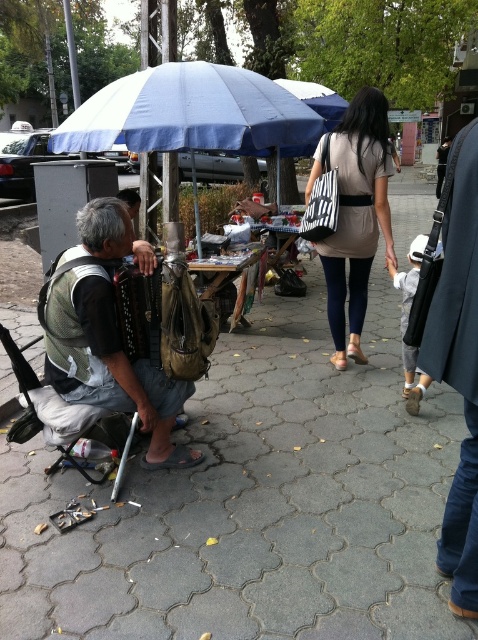
Between dark gray coat at right and beige fabric bag at center, which one is positioned higher?

beige fabric bag at center is higher up.

Between dark gray coat at right and beige fabric bag at center, which one appears on the left side from the viewer's perspective?

Positioned to the left is dark gray coat at right.

Is point (441, 352) farther from viewer compared to point (375, 120)?

No, (441, 352) is closer to viewer.

Find the location of a particular element. The height and width of the screenshot is (640, 478). dark gray coat at right is located at coordinates (455, 355).

Who is more distant from viewer, [226,524] or [90,220]?

Point [226,524]

Does point (375, 550) lie in front of point (131, 401)?

Yes, point (375, 550) is in front of point (131, 401).

Measure the distance between gray cobblestone pavement at center and camera.

gray cobblestone pavement at center and camera are 6.63 feet apart from each other.

At what (x,y) coordinates should I click in order to perform the action: click on gray cobblestone pavement at center. Please return your answer as a coordinate pair (x, y). This screenshot has height=640, width=478. Looking at the image, I should click on (254, 502).

In the scene shown: Who is taller, blue fabric umbrella at upper center or beige fabric bag at center?

beige fabric bag at center

Find the location of a particular element. blue fabric umbrella at upper center is located at coordinates (192, 113).